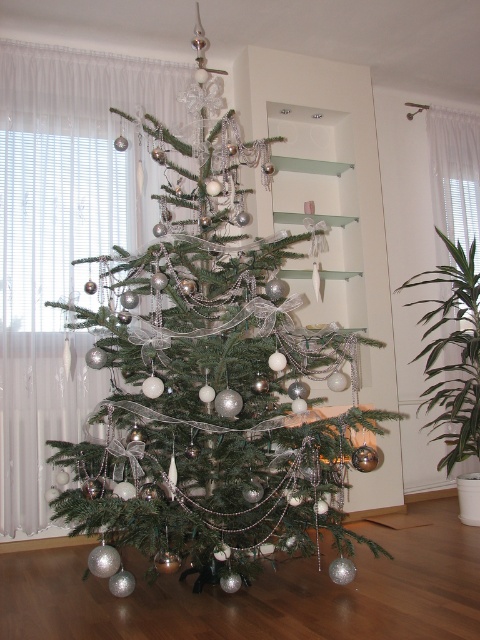
Question: Does shiny silver ornaments at center appear under green leafy plant at right?

Choices:
 (A) yes
 (B) no

Answer: (B)

Question: Which object is farther from the camera taking this photo?

Choices:
 (A) shiny silver ornaments at center
 (B) green leafy plant at right

Answer: (B)

Question: Among these objects, which one is nearest to the camera?

Choices:
 (A) green leafy plant at right
 (B) shiny silver ornaments at center

Answer: (B)

Question: From the image, what is the correct spatial relationship of shiny silver ornaments at center in relation to green leafy plant at right?

Choices:
 (A) above
 (B) below

Answer: (A)

Question: Is shiny silver ornaments at center below green leafy plant at right?

Choices:
 (A) no
 (B) yes

Answer: (A)